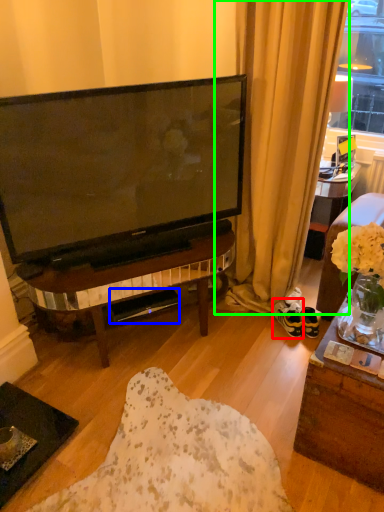
Question: Based on their relative distances, which object is nearer to footwear (highlighted by a red box)? Choose from loudspeaker (highlighted by a blue box) and curtain (highlighted by a green box).

Choices:
 (A) loudspeaker
 (B) curtain

Answer: (B)